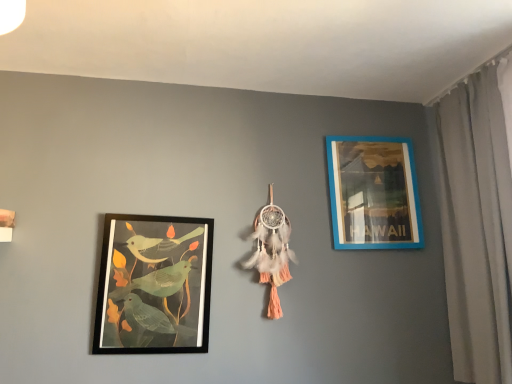
Question: Considering the positions of white fabric curtain at right and matte black picture frame at left, which ranks as the first picture frame in front-to-back order, in the image, is white fabric curtain at right wider or thinner than matte black picture frame at left, which ranks as the first picture frame in front-to-back order,?

Choices:
 (A) thin
 (B) wide

Answer: (B)

Question: From a real-world perspective, is white fabric curtain at right above or below matte black picture frame at left, which ranks as the first picture frame in front-to-back order?

Choices:
 (A) below
 (B) above

Answer: (B)

Question: Considering the real-world distances, which object is closest to the matte black picture frame at left, the first picture frame viewed from the left?

Choices:
 (A) blue plastic picture frame at upper right, which is counted as the 2th picture frame, starting from the left
 (B) white fabric curtain at right

Answer: (A)

Question: Which object is the closest to the blue plastic picture frame at upper right, which appears as the first picture frame when viewed from the back?

Choices:
 (A) matte black picture frame at left, which ranks as the first picture frame in front-to-back order
 (B) white fabric curtain at right

Answer: (B)